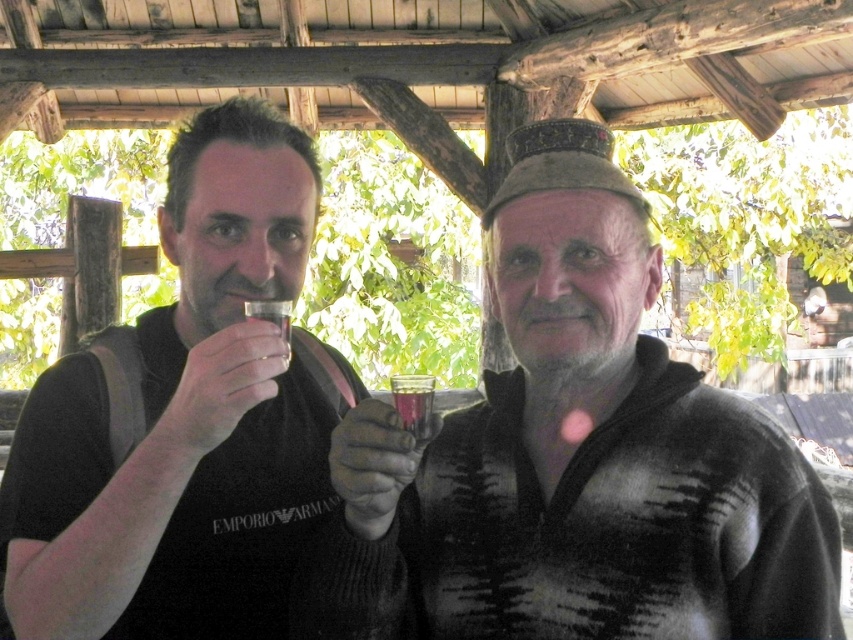
You are a photographer setting up a shot of the two people in the scene. You want to ensure that the matte black vest at left and the translucent glass at center are both in focus. Given that your camera has a depth of field that can cover 12 inches, will both objects be in focus?

The distance between the matte black vest at left and the translucent glass at center is 11.89 inches, which is within the camera depth of field of 12 inches. Therefore, both objects will be in focus.

You are a photographer setting up a shot of the two people under the pavilion. You need to ensure that the matte brown hat at center and the clear glass at center are both in focus. Which object should you focus on first to ensure depth of field covers both?

The matte brown hat at center is taller than the clear glass at center, so focusing on the matte brown hat at center first will ensure the depth of field includes the clear glass at center as well.